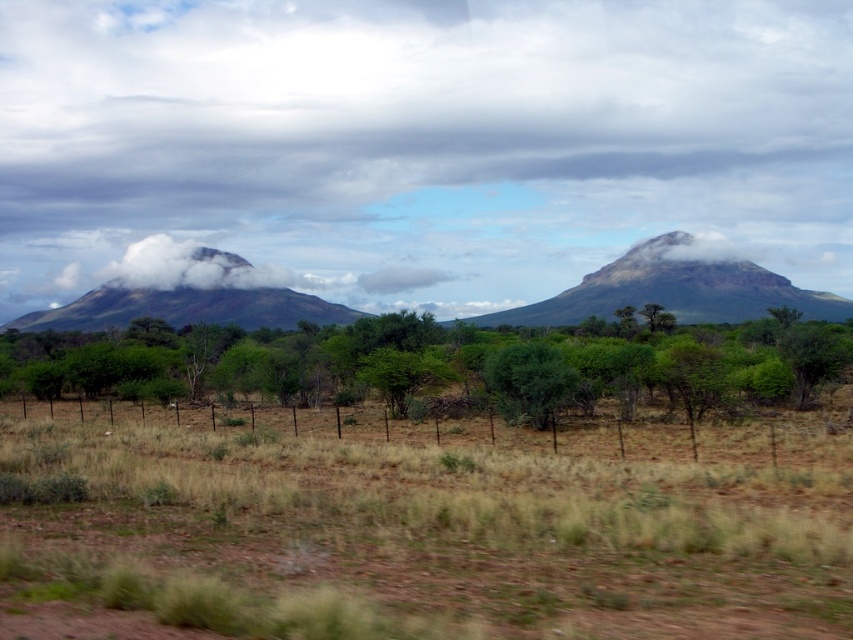
Who is positioned more to the right, gray/cloudy mountain at center or green leafy shrub at center?

Positioned to the right is green leafy shrub at center.

Which is more to the left, gray/cloudy mountain at center or green leafy shrub at center?

gray/cloudy mountain at center

Find the location of a particular element. This screenshot has width=853, height=640. gray/cloudy mountain at center is located at coordinates (422, 141).

Is the position of brown grass at center less distant than that of green matte mountain at left?

Yes, it is.

Describe the element at coordinates (421, 531) in the screenshot. This screenshot has height=640, width=853. I see `brown grass at center` at that location.

Is point (676, 541) less distant than point (119, 326)?

Yes, point (676, 541) is closer to viewer.

Find the location of a particular element. The image size is (853, 640). brown grass at center is located at coordinates (421, 531).

Is rugged brown mountain at center shorter than white fluffy cloud at left?

No.

Is point (585, 301) farther from viewer compared to point (270, 282)?

That is False.

Between point (612, 296) and point (209, 273), which one is positioned in front?

Point (612, 296)

Find the location of a particular element. Image resolution: width=853 pixels, height=640 pixels. rugged brown mountain at center is located at coordinates (672, 289).